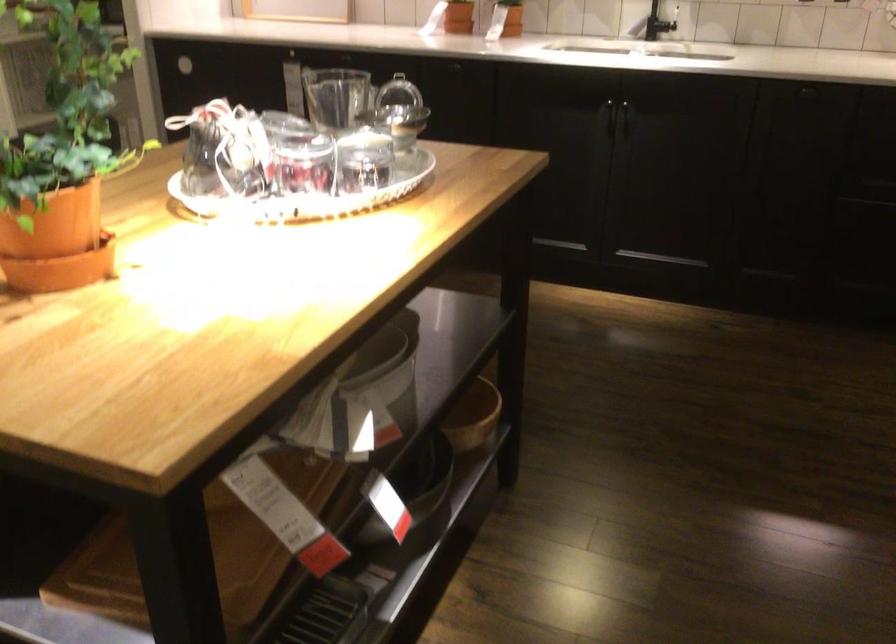
Describe the element at coordinates (399, 71) in the screenshot. I see `the glass jar lid` at that location.